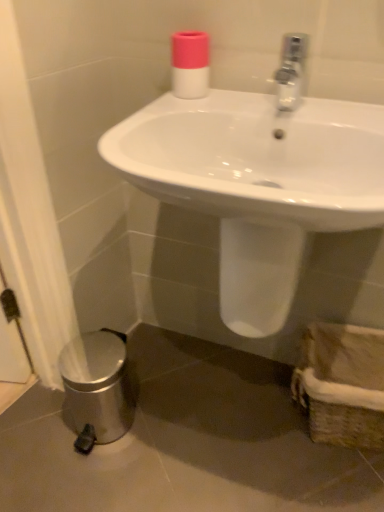
Locate an element on the screen. The image size is (384, 512). vacant space in front of pink matte bottle at upper center is located at coordinates (197, 104).